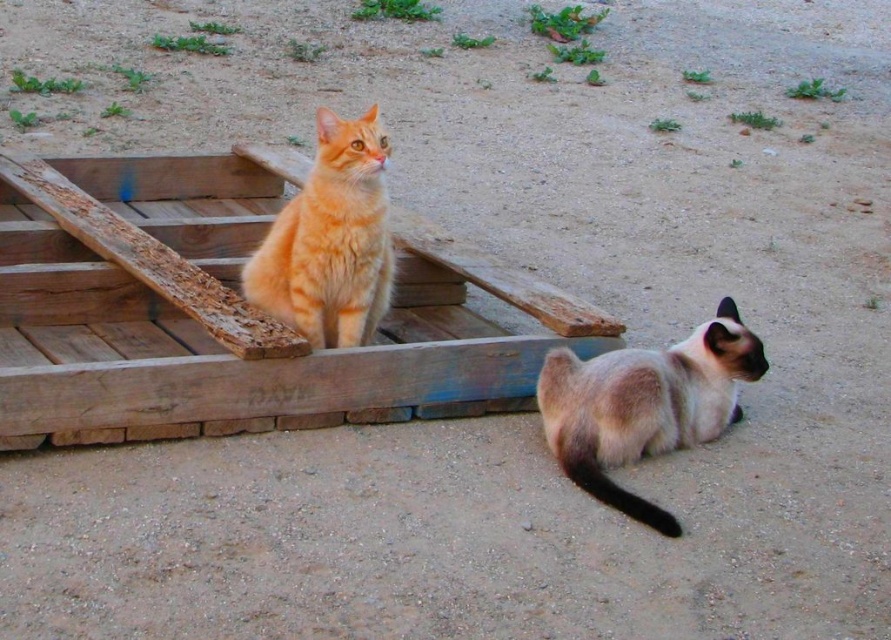
Is silky fur cat at lower right in front of orange fur cat at upper left?

Yes, it is.

The image size is (891, 640). What do you see at coordinates (644, 404) in the screenshot?
I see `silky fur cat at lower right` at bounding box center [644, 404].

Where is `silky fur cat at lower right`? The image size is (891, 640). silky fur cat at lower right is located at coordinates (644, 404).